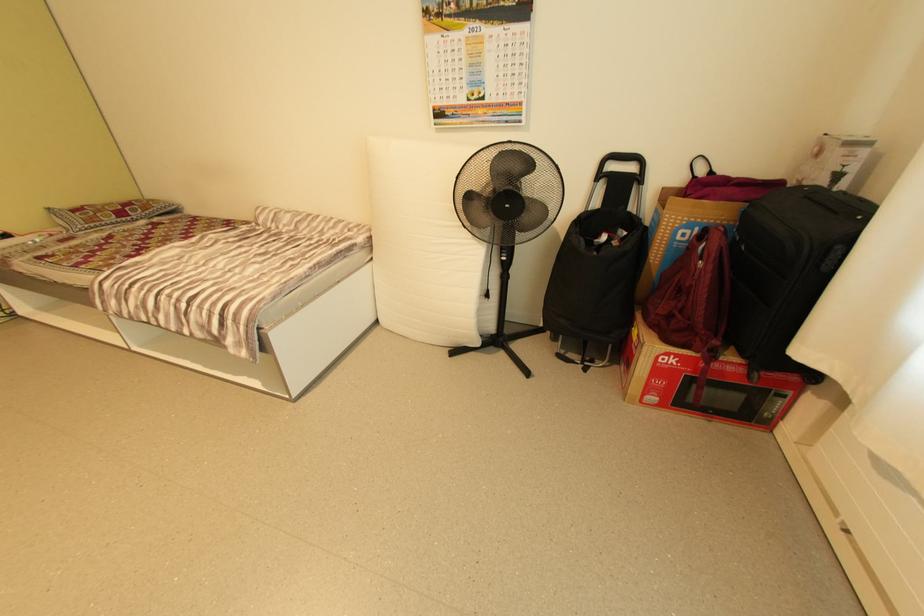
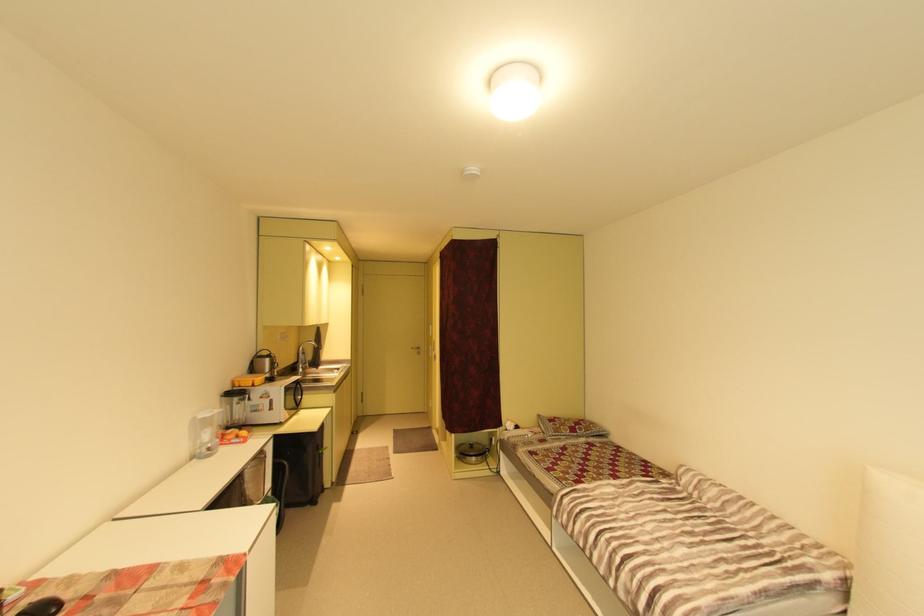
The images are taken continuously from a first-person perspective. In which direction is your viewpoint rotating?

The camera's rotation is toward left-up.